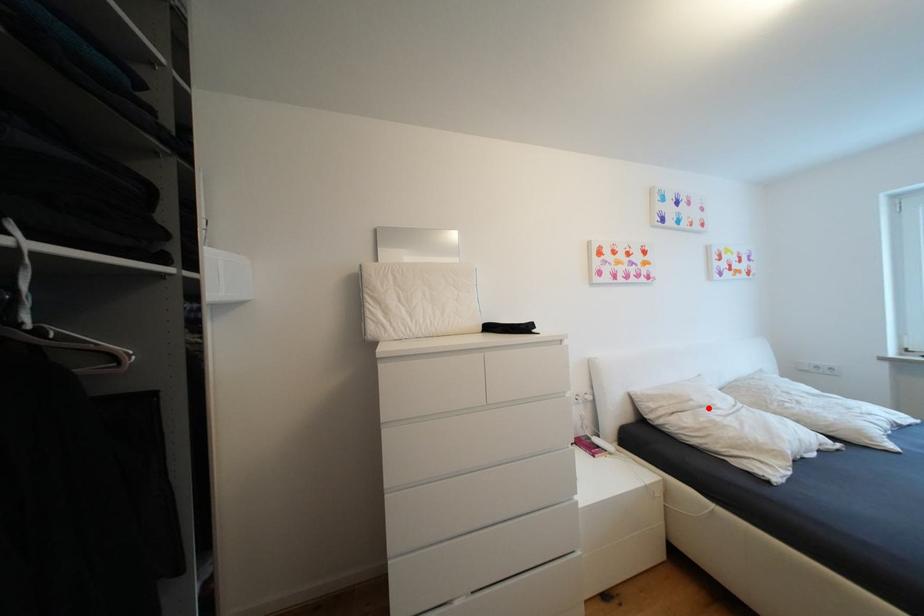
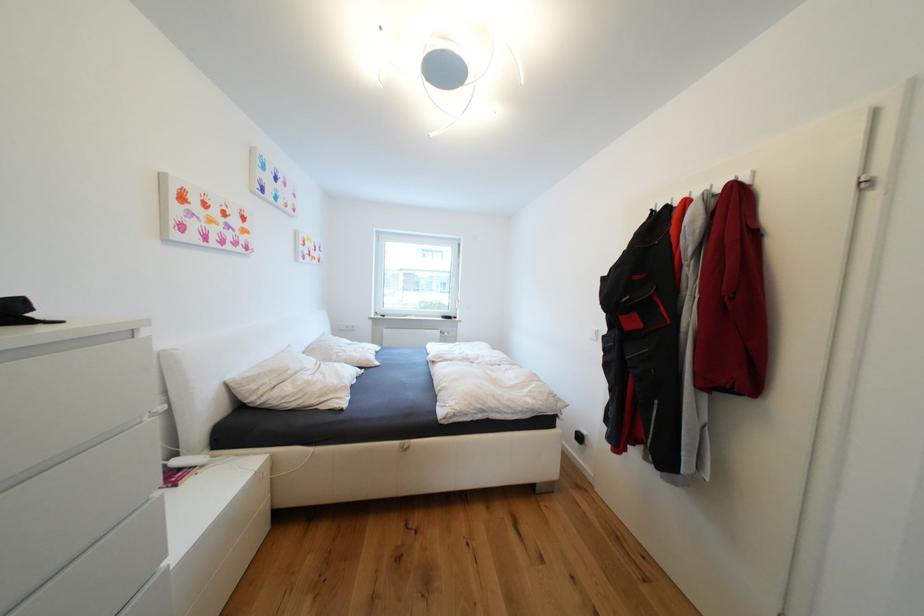
Question: I am providing you with two images of the same scene from different viewpoints. A red point is shown in image1. For the corresponding object point in image2, is it positioned nearer or farther from the camera?

Choices:
 (A) Nearer
 (B) Farther

Answer: (A)